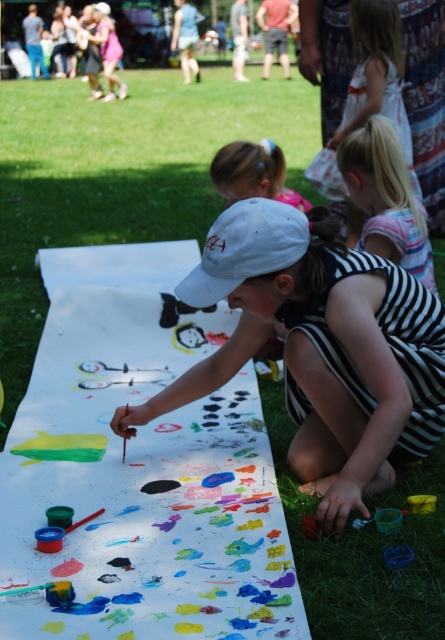
You are a photographer standing at the edge of the canvas. You want to take a photo that includes both the white matte cap at center and the pastel hairband at center. The camera you are using has a maximum focus range of 1 meter. Will both objects be in focus?

The white matte cap at center is 1.04 meters away from the pastel hairband at center. Since the camera can only focus within 1 meter, the distance between them exceeds the focus range. Therefore, both objects cannot be in focus simultaneously.

You are a photographer taking a picture of the scene. You notice the green grass at lower center and the pastel hairband at center. Which object will appear larger in the photo?

The green grass at lower center will appear larger in the photo because it is closer to the viewer than the pastel hairband at center.

You are a photographer trying to capture the scene of the children painting. You want to ensure that the white striped dress at center is positioned exactly at the center of your photo. Based on the coordinates provided, is the dress already centered? Explain your reasoning.

The white striped dress at center is located at coordinates point (359, 65). Since the center of the photo would typically be at coordinates (222, 320), the dress is not centered as its coordinates are significantly different from the center point.